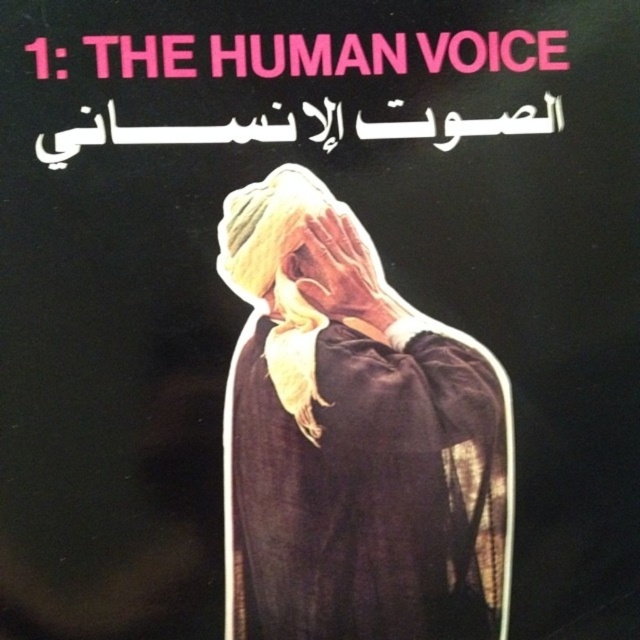
You are an artist analyzing the composition of the image. There is a point at coordinate [353,438]. What is the color and material of the surface at that point?

The point at coordinate [353,438] is on dark brown fabric at center.

You are an artist trying to replicate the scene from the image. You need to ensure the proportions between the dark brown fabric at center and the smooth skin hand at center are accurate. Which object should you make wider in your drawing?

The dark brown fabric at center should be made wider in the drawing since its width is larger than the smooth skin hand at center.